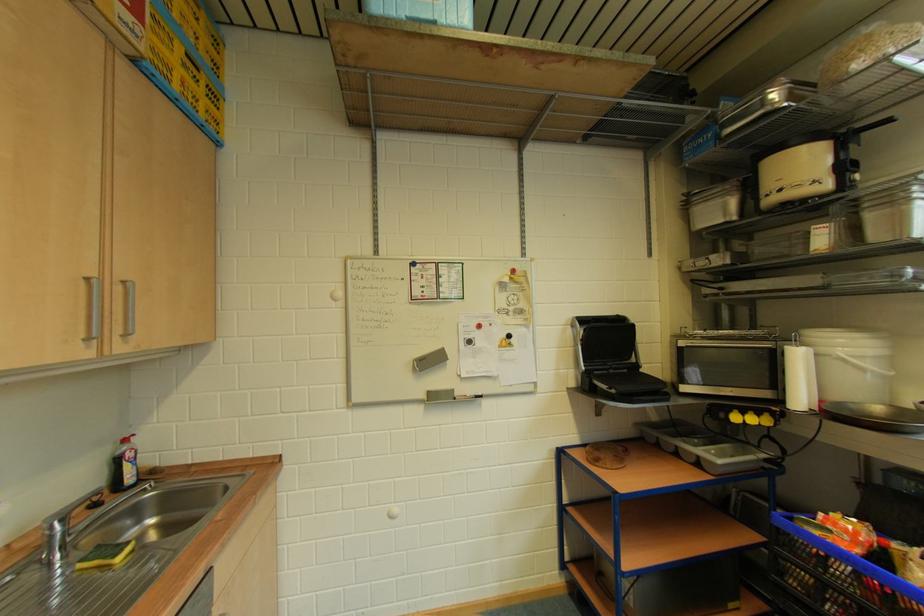
The height and width of the screenshot is (616, 924). I want to click on black grill handle, so (580, 341).